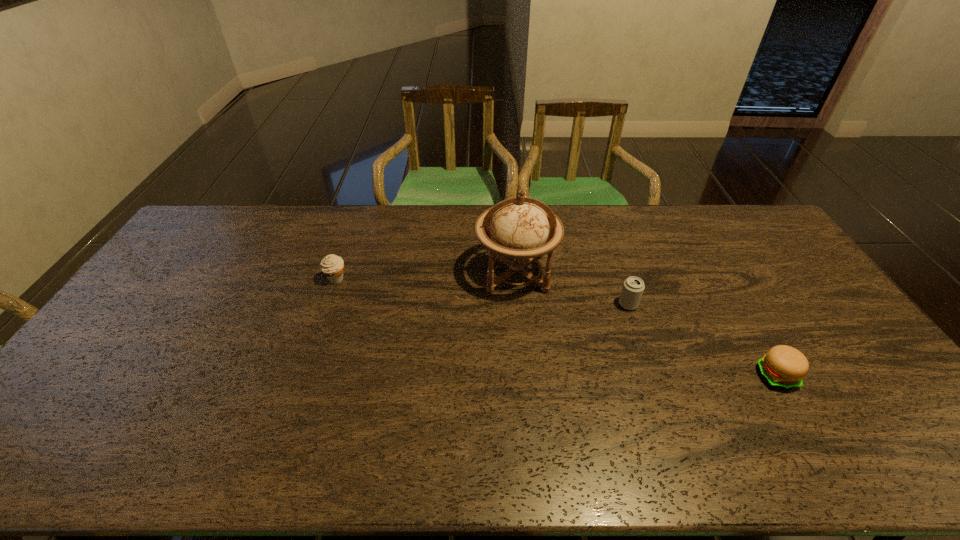
Where is `vacant position in the image that satisfies the following two spatial constraints: 1. on the front-facing side of the third object from right to left; 2. on the left side of the nearest object`? The image size is (960, 540). vacant position in the image that satisfies the following two spatial constraints: 1. on the front-facing side of the third object from right to left; 2. on the left side of the nearest object is located at coordinates 525,376.

In order to click on vacant region that satisfies the following two spatial constraints: 1. on the front-facing side of the second object from left to right; 2. on the left side of the hamburger in this screenshot , I will do `click(525, 376)`.

I want to click on free region that satisfies the following two spatial constraints: 1. on the front-facing side of the nearest object; 2. on the left side of the tallest object, so click(525, 376).